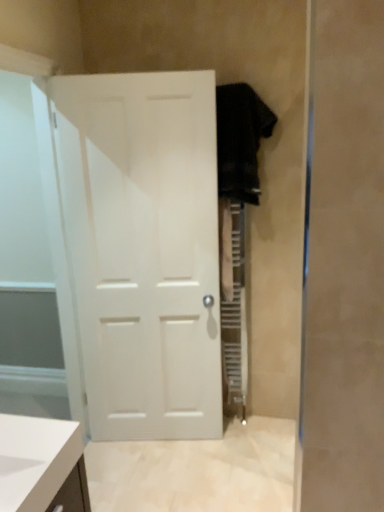
Locate an element on the screen. vacant space in white matte door at center (from a real-world perspective) is located at coordinates (165, 441).